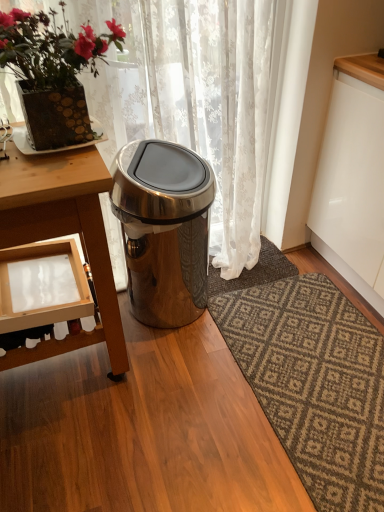
Where is `free spot above dark brown textured rug at lower right (from a real-world perspective)`? This screenshot has width=384, height=512. free spot above dark brown textured rug at lower right (from a real-world perspective) is located at coordinates (313, 362).